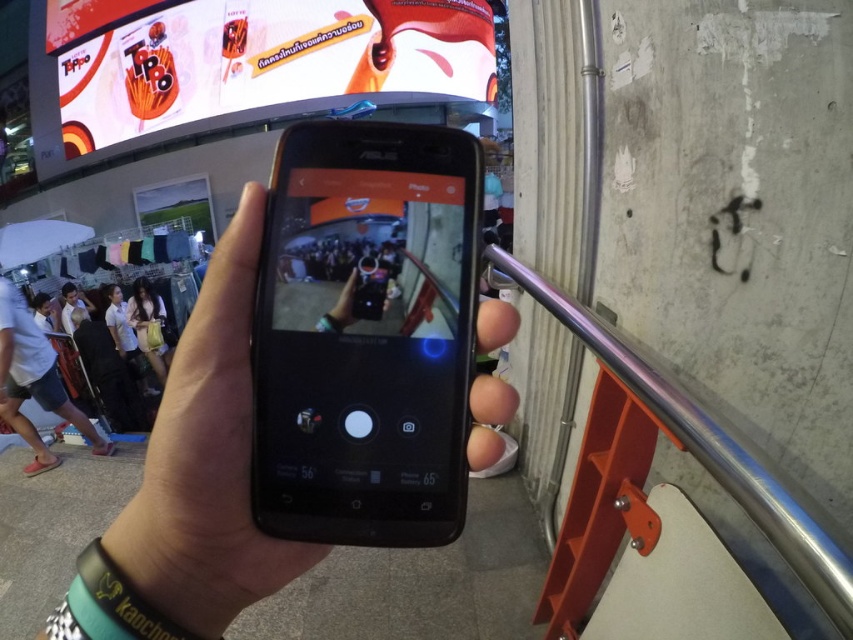
You are holding a black matte smartphone at center and a black matte phone at center in your hands. You want to place them side by side on a table without overlapping. What is the minimum distance you need between them?

The minimum distance needed between the black matte smartphone at center and the black matte phone at center is 5.63 centimeters to prevent overlapping.

You are a photographer trying to capture the crowd in the live viewfinder of the ASUS smartphone. The point at the center of the screen is marked as point (366, 336). Where is the black matte smartphone located relative to the crowd in the live viewfinder?

The point (366, 336) marks the black matte smartphone at center, so the smartphone is positioned at the center of the live viewfinder, directly facing the crowd.

You are trying to decide which clothing item to choose between the matte black dress at center and the white shirt at center. Based on their sizes, which one is wider?

The white shirt at center is wider than the matte black dress at center.